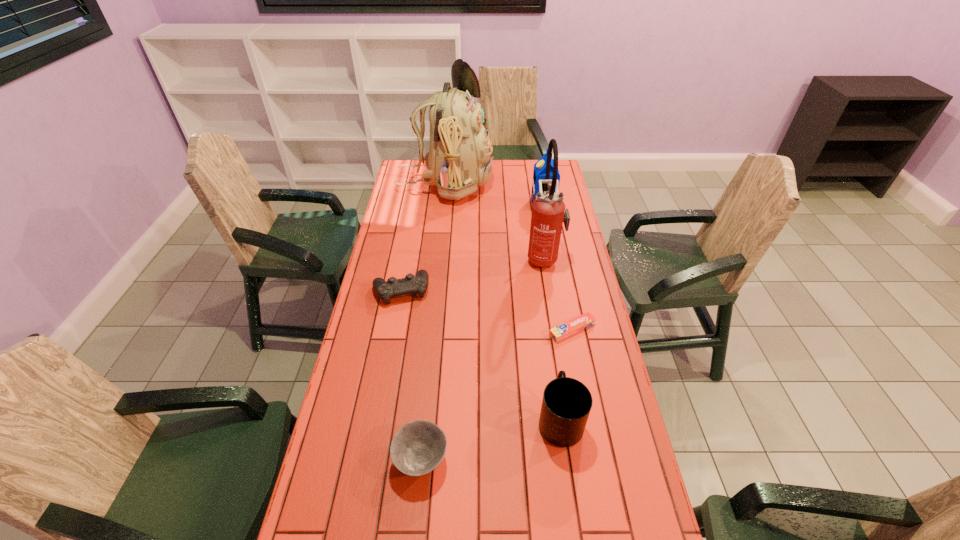
The image size is (960, 540). I want to click on backpack, so click(459, 160).

At what (x,y) coordinates should I click in order to perform the action: click on fire extinguisher. Please return your answer as a coordinate pair (x, y). This screenshot has width=960, height=540. Looking at the image, I should click on (548, 209).

This screenshot has width=960, height=540. I want to click on the third tallest object, so click(539, 173).

This screenshot has width=960, height=540. What are the coordinates of `the fourth shortest object` in the screenshot? It's located at (566, 404).

You are a GUI agent. You are given a task and a screenshot of the screen. Output one action in this format:
    pyautogui.click(x=<x>, y=<y>)
    Task: Click on the fourth nearest object
    The width and height of the screenshot is (960, 540).
    Given the screenshot: What is the action you would take?
    pyautogui.click(x=411, y=284)

This screenshot has width=960, height=540. Find the location of `bowl`. bowl is located at coordinates (418, 447).

You are a GUI agent. You are given a task and a screenshot of the screen. Output one action in this format:
    pyautogui.click(x=<x>, y=<y>)
    Task: Click on the shortest object
    
    Given the screenshot: What is the action you would take?
    pyautogui.click(x=571, y=327)

Find the location of a particular element. The image size is (960, 540). toothpaste is located at coordinates (571, 327).

At what (x,y) coordinates should I click in order to perform the action: click on free point located 0.310m on the front-facing side of the backpack. Please return your answer as a coordinate pair (x, y). The height and width of the screenshot is (540, 960). Looking at the image, I should click on (557, 184).

This screenshot has width=960, height=540. I want to click on vacant space located at the nozzle of the fire extinguisher, so click(x=512, y=258).